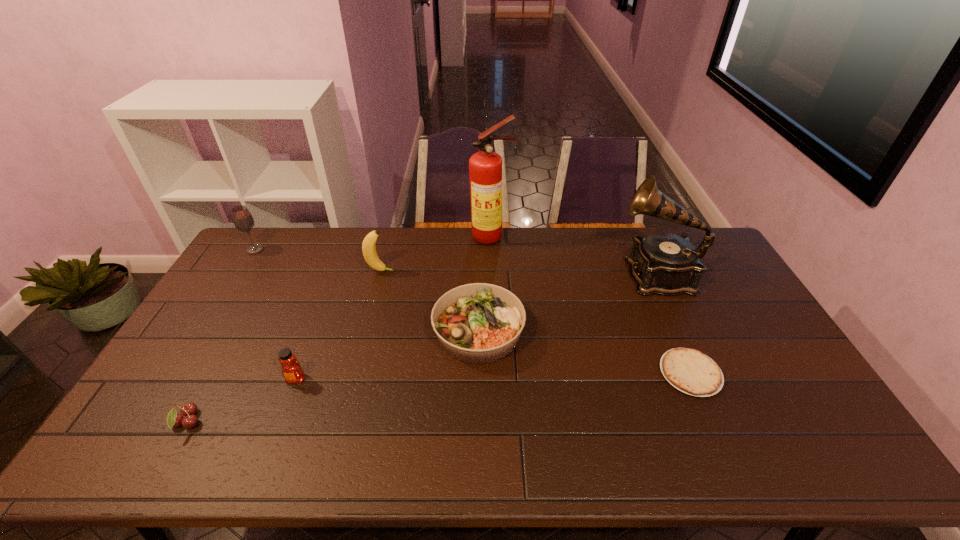
Locate an element on the screen. fire extinguisher is located at coordinates pyautogui.click(x=485, y=167).

Identify the location of the seventh shortest object. The width and height of the screenshot is (960, 540). (662, 263).

Locate an element on the screen. The image size is (960, 540). glass drink container is located at coordinates (242, 218).

Where is `the fifth object from right to left`? the fifth object from right to left is located at coordinates (370, 255).

The image size is (960, 540). What are the coordinates of `the fourth shortest object` in the screenshot? It's located at pos(292,371).

In order to click on the sixth object from right to left in this screenshot , I will do `click(292, 371)`.

You are a GUI agent. You are given a task and a screenshot of the screen. Output one action in this format:
    pyautogui.click(x=<x>, y=<y>)
    Task: Click on the salad plate
    The width and height of the screenshot is (960, 540).
    Given the screenshot: What is the action you would take?
    pyautogui.click(x=477, y=323)

What are the coordinates of `cherry` in the screenshot? It's located at (188, 410).

Find the location of a particular element. the seventh object from right to left is located at coordinates (188, 410).

You are a GUI agent. You are given a task and a screenshot of the screen. Output one action in this format:
    pyautogui.click(x=<x>, y=<y>)
    Task: Click on the tortilla
    The image size is (960, 540).
    Given the screenshot: What is the action you would take?
    pyautogui.click(x=690, y=371)